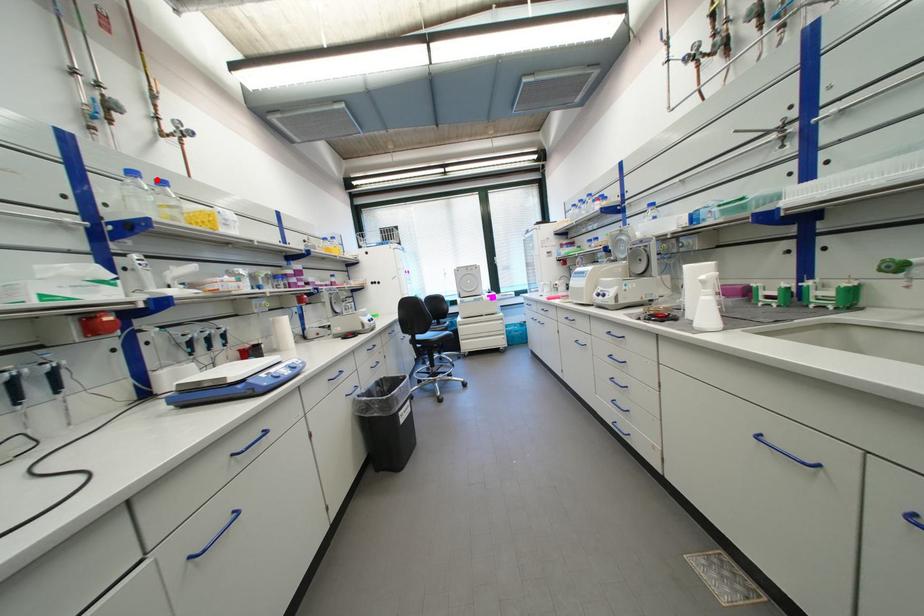
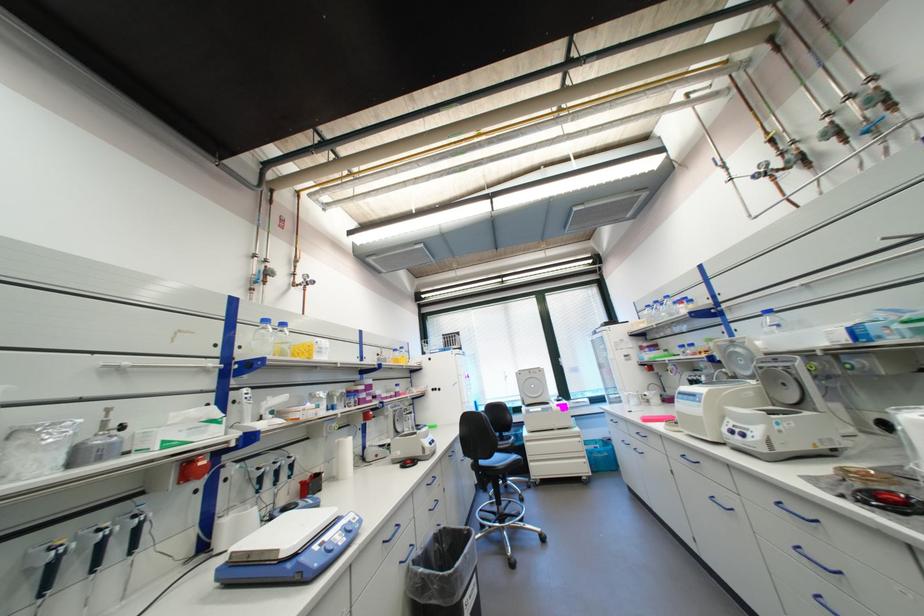
The point at the highlighted location is marked in the first image. Where is the corresponding point in the second image?

(283, 323)